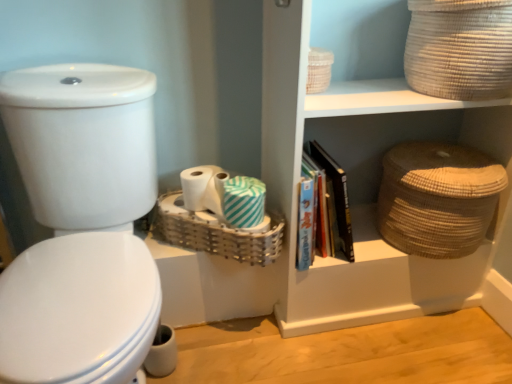
Locate an element on the screen. vacant space that is in between teal striped toilet paper at center, which is the first toilet paper in right-to-left order, and white paper roll at center is located at coordinates (208, 211).